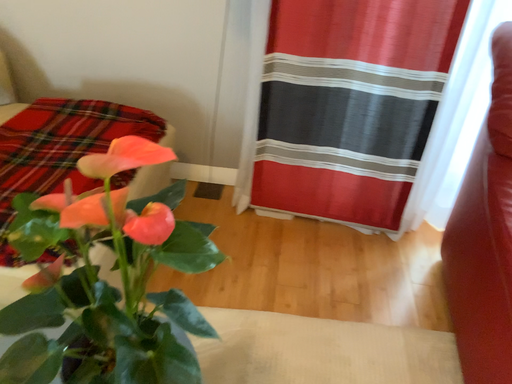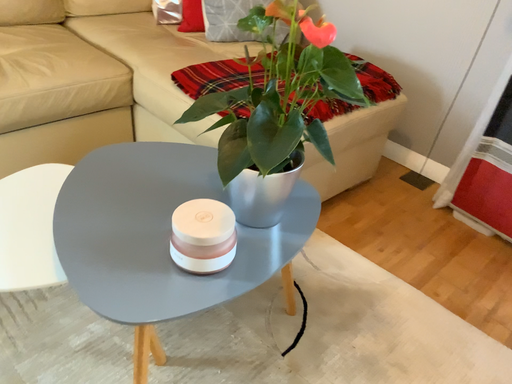
Question: Which way did the camera rotate in the video?

Choices:
 (A) rotated downward
 (B) rotated upward

Answer: (B)